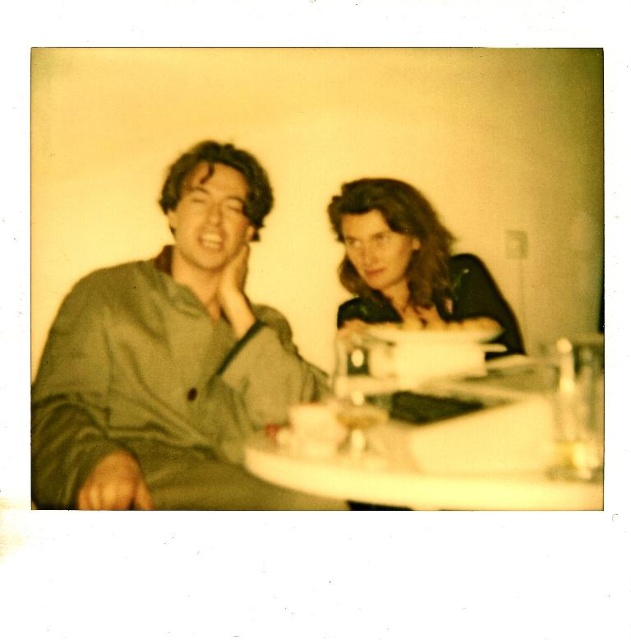
You are standing in front of a Polaroid photo and want to know which of the two points, point (389, 429) or point (468, 272), is closer to you. Based on the image description, which point is nearer?

Point (389, 429) is in front of point (468, 272), so it is closer to you.